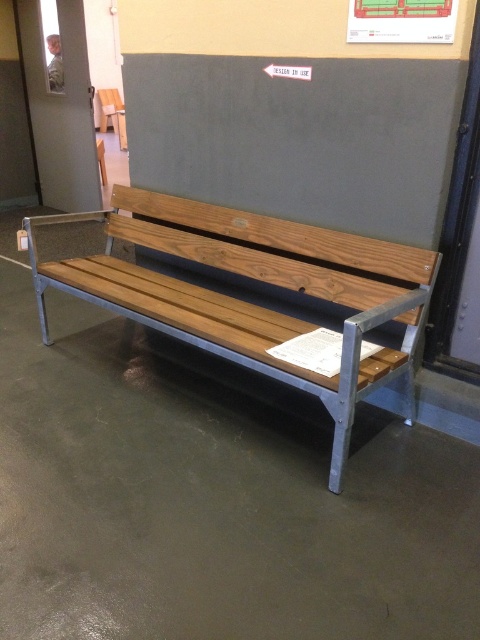
Which is below, wooden bench at center or matte white paper at upper center?

wooden bench at center

Is wooden bench at center positioned before matte white paper at upper center?

Yes, it is.

Between point (167, 236) and point (362, 8), which one is positioned behind?

The point (167, 236) is more distant.

At what (x,y) coordinates should I click in order to perform the action: click on wooden bench at center. Please return your answer as a coordinate pair (x, y). The height and width of the screenshot is (640, 480). Looking at the image, I should click on (252, 304).